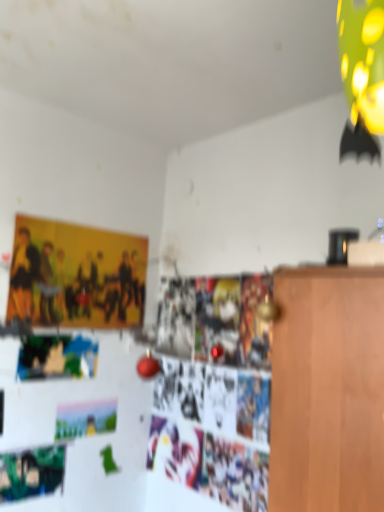
Question: From the image's perspective, is pastel matte postcard at lower left above green matte poster at lower left?

Choices:
 (A) no
 (B) yes

Answer: (B)

Question: Is pastel matte postcard at lower left behind green matte poster at lower left?

Choices:
 (A) no
 (B) yes

Answer: (B)

Question: Is pastel matte postcard at lower left to the left of green matte poster at lower left from the viewer's perspective?

Choices:
 (A) no
 (B) yes

Answer: (A)

Question: Does pastel matte postcard at lower left have a greater height compared to green matte poster at lower left?

Choices:
 (A) yes
 (B) no

Answer: (B)

Question: Is pastel matte postcard at lower left turned away from green matte poster at lower left?

Choices:
 (A) no
 (B) yes

Answer: (A)

Question: In the image, is pastel matte postcard at lower left on the left side or the right side of matte yellow poster at upper left?

Choices:
 (A) right
 (B) left

Answer: (A)

Question: Considering their positions, is pastel matte postcard at lower left located in front of or behind matte yellow poster at upper left?

Choices:
 (A) behind
 (B) front

Answer: (A)

Question: In terms of size, does pastel matte postcard at lower left appear bigger or smaller than matte yellow poster at upper left?

Choices:
 (A) small
 (B) big

Answer: (A)

Question: Which is correct: pastel matte postcard at lower left is inside matte yellow poster at upper left, or outside of it?

Choices:
 (A) outside
 (B) inside

Answer: (A)

Question: Is point (89, 273) closer or farther from the camera than point (59, 434)?

Choices:
 (A) farther
 (B) closer

Answer: (A)

Question: From the image's perspective, is matte yellow poster at upper left above or below pastel matte postcard at lower left?

Choices:
 (A) above
 (B) below

Answer: (A)

Question: From their relative heights in the image, would you say matte yellow poster at upper left is taller or shorter than pastel matte postcard at lower left?

Choices:
 (A) short
 (B) tall

Answer: (B)

Question: Looking at the image, does matte yellow poster at upper left seem bigger or smaller compared to pastel matte postcard at lower left?

Choices:
 (A) small
 (B) big

Answer: (B)

Question: From the image's perspective, is green matte poster at lower left above or below pastel matte postcard at lower left?

Choices:
 (A) above
 (B) below

Answer: (B)

Question: In terms of size, does green matte poster at lower left appear bigger or smaller than pastel matte postcard at lower left?

Choices:
 (A) big
 (B) small

Answer: (A)